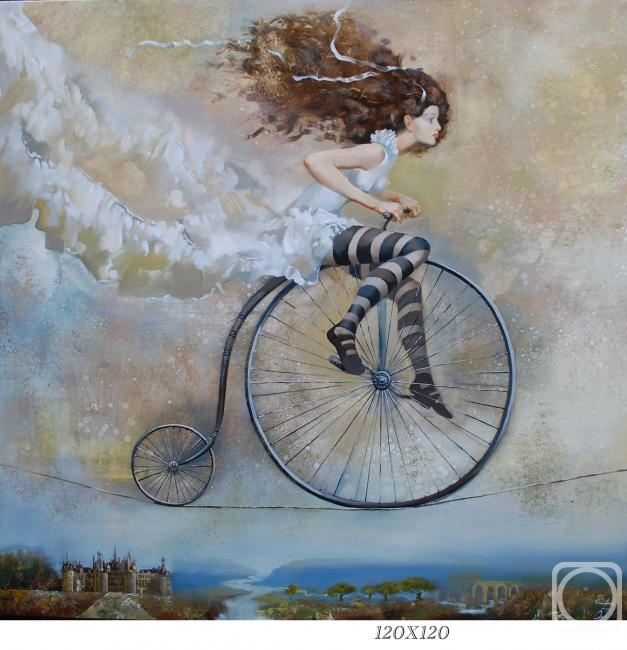
Where is `cable`? This screenshot has height=650, width=627. cable is located at coordinates (217, 506).